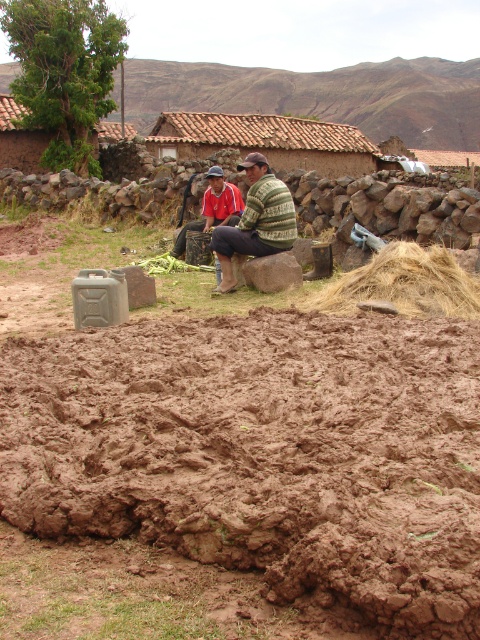
You are a farmer who needs to plant crops in the brown muddy field at center and the red fabric squat at center. Which area has a smaller width for planting?

The brown muddy field at center has a smaller width than the red fabric squat at center, so it is the smaller area for planting.

You are standing at the camera position and want to walk to the brown muddy field at center. Which direction should you move relative to your current position?

The brown muddy field at center is located at point coordinates, so you should move towards the center of the image to reach it.